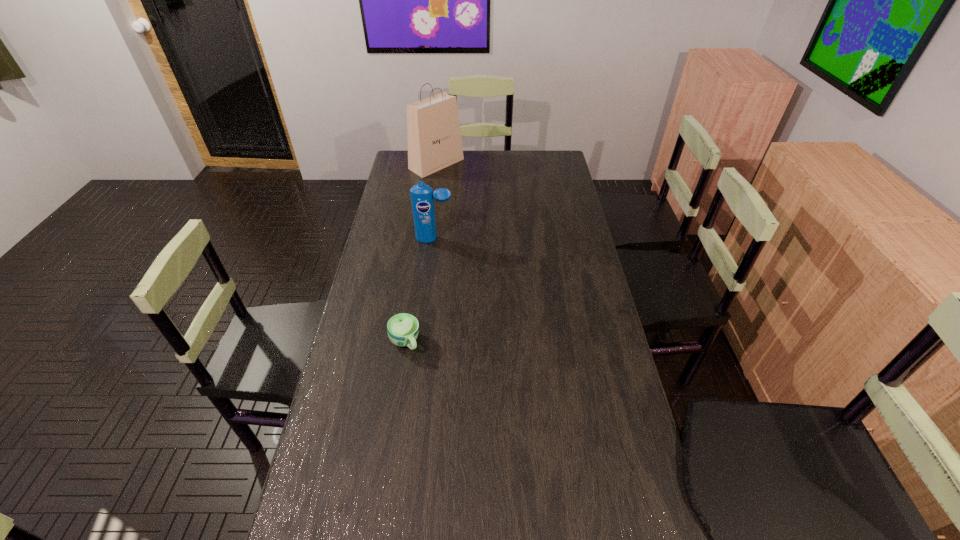
The width and height of the screenshot is (960, 540). I want to click on vacant point located between the second nearest object and the farthest object, so click(x=436, y=201).

This screenshot has width=960, height=540. I want to click on vacant space that is in between the shampoo and the farthest object, so click(436, 201).

The image size is (960, 540). Identify the location of empty space between the farthest object and the second tallest object. (436, 201).

Where is `the closest object to the tallest object`? the closest object to the tallest object is located at coordinates (422, 195).

At what (x,y) coordinates should I click in order to perform the action: click on object that ranks as the closest to the shortest object. Please return your answer as a coordinate pair (x, y). Looking at the image, I should click on (422, 195).

Locate an element on the screen. The width and height of the screenshot is (960, 540). vacant space that satisfies the following two spatial constraints: 1. on the front side of the tallest object; 2. on the right side of the second farthest object is located at coordinates (426, 239).

At what (x,y) coordinates should I click in order to perform the action: click on free spot that satisfies the following two spatial constraints: 1. on the front side of the second shortest object; 2. on the right side of the tallest object. Please return your answer as a coordinate pair (x, y). Looking at the image, I should click on (426, 239).